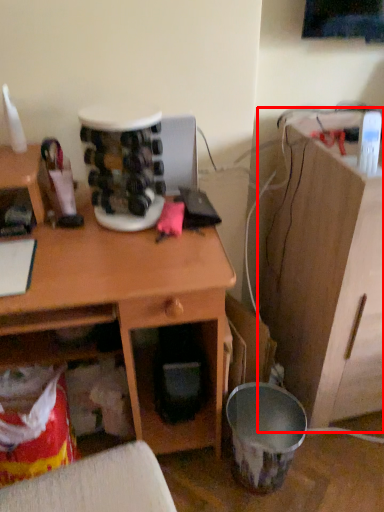
Question: From the image, what is the correct spatial relationship of computer desk (annotated by the red box) in relation to desk?

Choices:
 (A) left
 (B) right

Answer: (B)